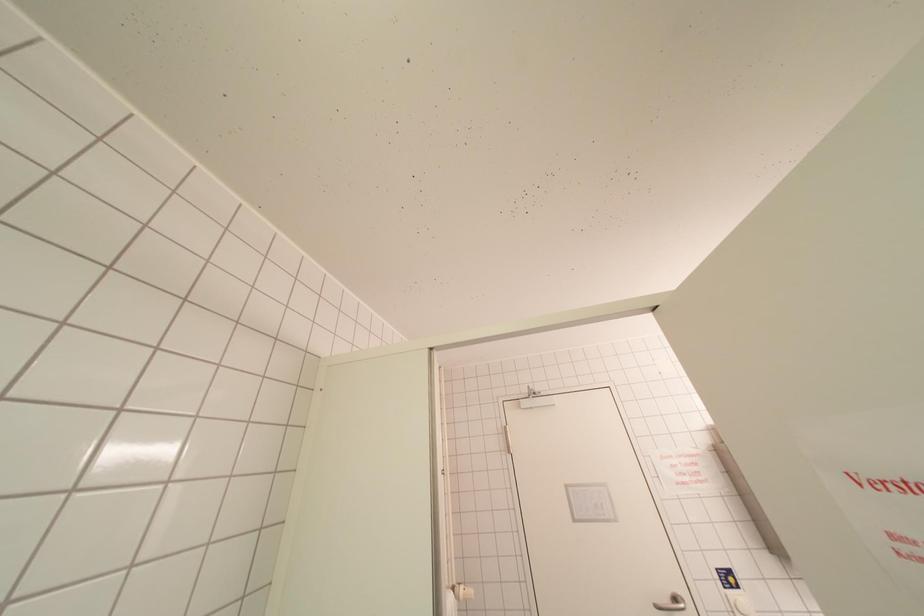
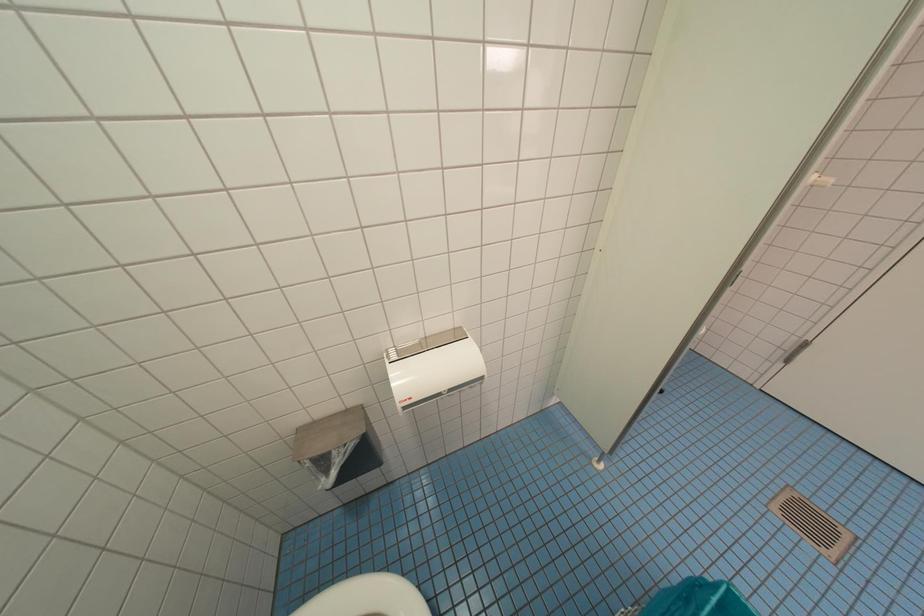
Based on the continuous images, in which direction is the camera rotating?

The camera rotated toward left-down.